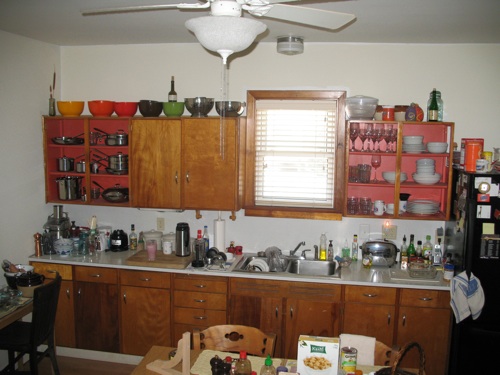
This screenshot has width=500, height=375. Identify the location of filled sink. (272, 266), (250, 266), (278, 266), (258, 265).